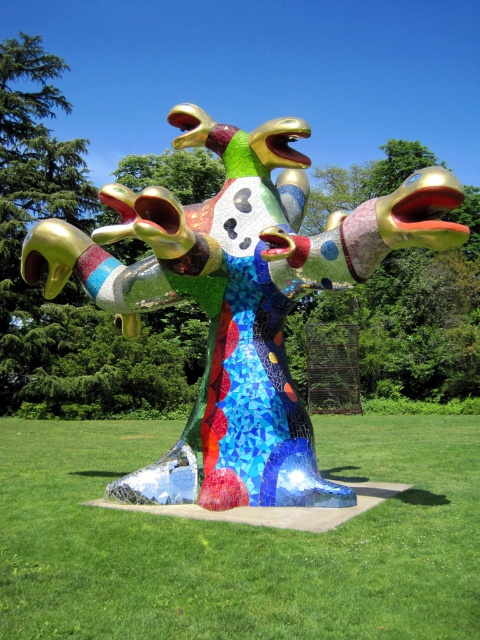
Which of these two, mosaic sculpture at center or mosaic multicolored sculpture at center, stands shorter?

mosaic multicolored sculpture at center

Describe the element at coordinates (240, 541) in the screenshot. This screenshot has height=640, width=480. I see `mosaic sculpture at center` at that location.

This screenshot has width=480, height=640. Identify the location of mosaic sculpture at center. (240, 541).